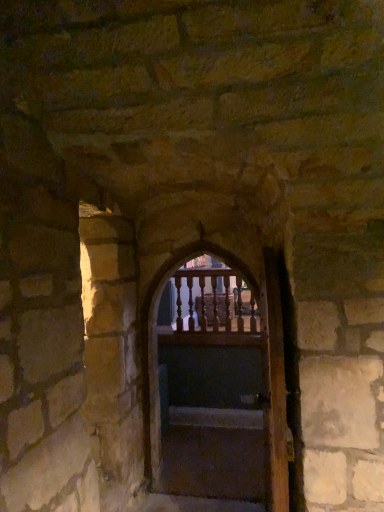
In order to face wooden at center, acting as the second door starting from the front, should I rotate leftwards or rightwards?

Turn right approximately 1.694 degrees to face it.

Measure the distance between point (269, 335) and camera.

Point (269, 335) and camera are 2.84 meters apart.

Locate an element on the screen. The image size is (384, 512). smooth concrete stairs at center is located at coordinates (214, 454).

Describe the element at coordinates (214, 454) in the screenshot. I see `smooth concrete stairs at center` at that location.

You are a GUI agent. You are given a task and a screenshot of the screen. Output one action in this format:
    pyautogui.click(x=<x>, y=<y>)
    Task: Click on the wooden at center, which is counted as the first door, starting from the back
    The width and height of the screenshot is (384, 512).
    Given the screenshot: What is the action you would take?
    tap(221, 391)

Looking at the image, does wooden door at center, which is the second door from back to front, seem bigger or smaller compared to wooden at center, which is counted as the first door, starting from the back?

wooden door at center, which is the second door from back to front, is smaller than wooden at center, which is counted as the first door, starting from the back.

From a real-world perspective, is wooden door at center, which is the second door from back to front, physically located above or below wooden at center, which is counted as the first door, starting from the back?

From a real-world perspective, wooden door at center, which is the second door from back to front, is physically below wooden at center, which is counted as the first door, starting from the back.

Which object is positioned more to the left, wooden door at center, which is the second door from back to front, or wooden at center, acting as the second door starting from the front?

wooden at center, acting as the second door starting from the front, is more to the left.

Which of these two, wooden door at center, marked as the 1th door in a front-to-back arrangement, or wooden at center, acting as the second door starting from the front, is wider?

With larger width is wooden at center, acting as the second door starting from the front.

At what (x,y) coordinates should I click in order to perform the action: click on door on the left of smooth concrete stairs at center. Please return your answer as a coordinate pair (x, y). This screenshot has height=512, width=384. Looking at the image, I should click on (221, 391).

Is the surface of smooth concrete stairs at center in direct contact with wooden at center, which is counted as the first door, starting from the back?

No, smooth concrete stairs at center is not next to wooden at center, which is counted as the first door, starting from the back.

From the image's perspective, which object appears higher, smooth concrete stairs at center or wooden at center, acting as the second door starting from the front?

From the image's view, wooden at center, acting as the second door starting from the front, is above.

Can you tell me how much smooth concrete stairs at center and wooden at center, which is counted as the first door, starting from the back, differ in facing direction?

1.32 degrees separate the facing orientations of smooth concrete stairs at center and wooden at center, which is counted as the first door, starting from the back.

Is wooden door at center, marked as the 1th door in a front-to-back arrangement, facing towards smooth concrete stairs at center?

No, wooden door at center, marked as the 1th door in a front-to-back arrangement, is not aimed at smooth concrete stairs at center.

From a real-world perspective, who is located higher, wooden door at center, marked as the 1th door in a front-to-back arrangement, or smooth concrete stairs at center?

From a 3D spatial view, wooden door at center, marked as the 1th door in a front-to-back arrangement, is above.

The height and width of the screenshot is (512, 384). I want to click on the 1st door above the smooth concrete stairs at center (from the image's perspective), so click(x=278, y=381).

Can you confirm if wooden at center, acting as the second door starting from the front, is positioned to the right of smooth concrete stairs at center?

Incorrect, wooden at center, acting as the second door starting from the front, is not on the right side of smooth concrete stairs at center.

From the picture: Is smooth concrete stairs at center surrounded by wooden at center, acting as the second door starting from the front?

No, smooth concrete stairs at center is not a part of wooden at center, acting as the second door starting from the front.

Is wooden at center, acting as the second door starting from the front, taller than smooth concrete stairs at center?

Indeed, wooden at center, acting as the second door starting from the front, has a greater height compared to smooth concrete stairs at center.

Is wooden at center, which is counted as the first door, starting from the back, facing towards smooth concrete stairs at center?

No, wooden at center, which is counted as the first door, starting from the back, is not aimed at smooth concrete stairs at center.

From a real-world perspective, is wooden at center, which is counted as the first door, starting from the back, positioned above or below wooden door at center, which is the second door from back to front?

From a real-world perspective, wooden at center, which is counted as the first door, starting from the back, is physically above wooden door at center, which is the second door from back to front.

Is wooden at center, which is counted as the first door, starting from the back, oriented away from wooden door at center, which is the second door from back to front?

No, wooden at center, which is counted as the first door, starting from the back,'s orientation is not away from wooden door at center, which is the second door from back to front.

Would you say wooden at center, acting as the second door starting from the front, is outside wooden door at center, marked as the 1th door in a front-to-back arrangement?

Indeed, wooden at center, acting as the second door starting from the front, is completely outside wooden door at center, marked as the 1th door in a front-to-back arrangement.

Considering the points (273, 266) and (284, 264), which point is behind, point (273, 266) or point (284, 264)?

Positioned behind is point (273, 266).

Consider the image. Between smooth concrete stairs at center and wooden door at center, which is the second door from back to front, which one appears on the right side from the viewer's perspective?

From the viewer's perspective, wooden door at center, which is the second door from back to front, appears more on the right side.

Which door is the 2nd one when counting from the front of the smooth concrete stairs at center? Please provide its 2D coordinates.

[(278, 381)]

Considering the relative sizes of smooth concrete stairs at center and wooden door at center, which is the second door from back to front, in the image provided, is smooth concrete stairs at center shorter than wooden door at center, which is the second door from back to front,?

Indeed, smooth concrete stairs at center has a lesser height compared to wooden door at center, which is the second door from back to front.

In the scene shown: Which of these two, smooth concrete stairs at center or wooden door at center, which is the second door from back to front, is bigger?

wooden door at center, which is the second door from back to front, is bigger.

The height and width of the screenshot is (512, 384). Find the location of `door behind the wooden door at center, marked as the 1th door in a front-to-back arrangement`. door behind the wooden door at center, marked as the 1th door in a front-to-back arrangement is located at coordinates (221, 391).

Where is `stairs to the right of wooden at center, which is counted as the first door, starting from the back`? stairs to the right of wooden at center, which is counted as the first door, starting from the back is located at coordinates (214, 454).

Which object lies nearer to the anchor point wooden door at center, marked as the 1th door in a front-to-back arrangement, smooth concrete stairs at center or wooden at center, acting as the second door starting from the front?

smooth concrete stairs at center is positioned closer to the anchor wooden door at center, marked as the 1th door in a front-to-back arrangement.

From the image, which object appears to be farther from wooden door at center, marked as the 1th door in a front-to-back arrangement, wooden at center, which is counted as the first door, starting from the back, or smooth concrete stairs at center?

wooden at center, which is counted as the first door, starting from the back, is further to wooden door at center, marked as the 1th door in a front-to-back arrangement.

Which object lies nearer to the anchor point wooden at center, acting as the second door starting from the front, smooth concrete stairs at center or wooden door at center, marked as the 1th door in a front-to-back arrangement?

smooth concrete stairs at center is positioned closer to the anchor wooden at center, acting as the second door starting from the front.

Which object lies nearer to the anchor point smooth concrete stairs at center, wooden door at center, which is the second door from back to front, or wooden at center, which is counted as the first door, starting from the back?

wooden at center, which is counted as the first door, starting from the back.

When comparing their distances from smooth concrete stairs at center, does wooden at center, acting as the second door starting from the front, or wooden door at center, which is the second door from back to front, seem further?

Based on the image, wooden door at center, which is the second door from back to front, appears to be further to smooth concrete stairs at center.

When comparing their distances from wooden at center, acting as the second door starting from the front, does wooden door at center, which is the second door from back to front, or smooth concrete stairs at center seem further?

The object further to wooden at center, acting as the second door starting from the front, is wooden door at center, which is the second door from back to front.

This screenshot has height=512, width=384. Find the location of `door positioned between wooden door at center, marked as the 1th door in a front-to-back arrangement, and smooth concrete stairs at center from near to far`. door positioned between wooden door at center, marked as the 1th door in a front-to-back arrangement, and smooth concrete stairs at center from near to far is located at coordinates (221, 391).